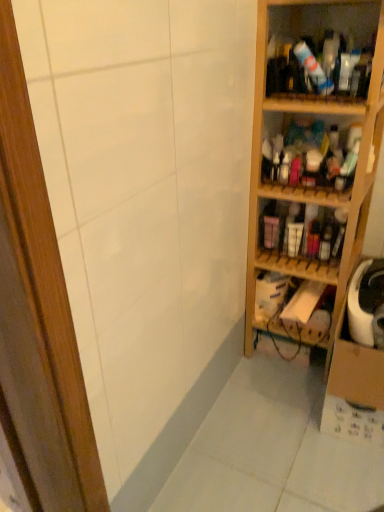
Find the location of a particular element. This screenshot has height=512, width=384. free space in front of wooden shelf at right, the 3th shelf in the top-to-bottom sequence is located at coordinates (280, 402).